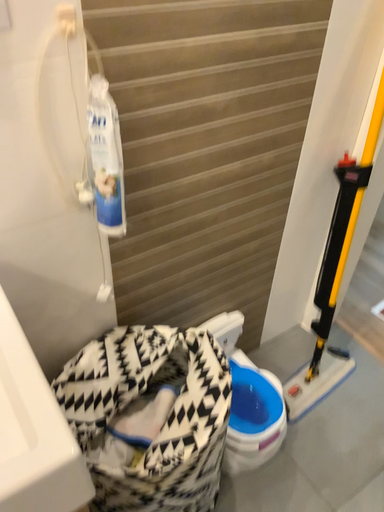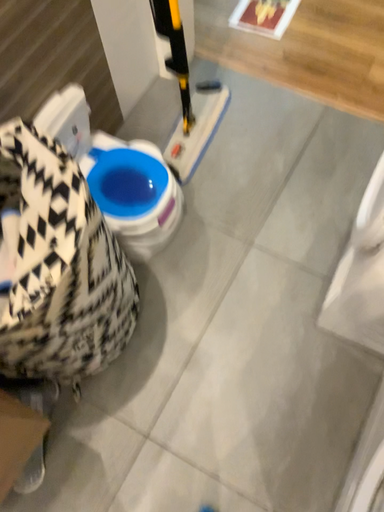
Question: Which way did the camera rotate in the video?

Choices:
 (A) rotated left
 (B) rotated right

Answer: (B)